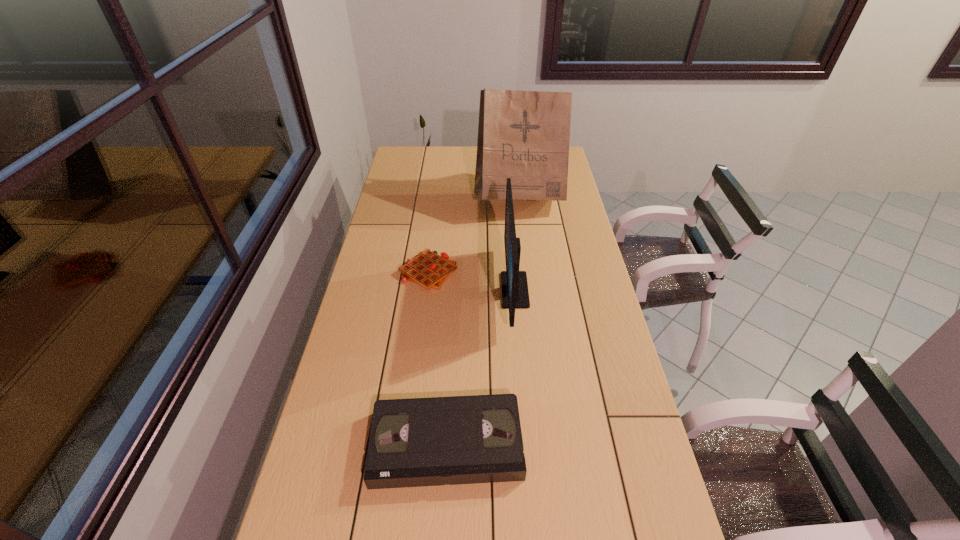
I want to click on free space that is in between the shortest object and the farthest object, so click(x=473, y=237).

This screenshot has height=540, width=960. What are the coordinates of `vacant space in between the nearest object and the computer monitor` in the screenshot? It's located at (481, 367).

Find the location of a particular element. vacant space that is in between the waffle and the grocery bag is located at coordinates (473, 237).

Image resolution: width=960 pixels, height=540 pixels. I want to click on vacant space that is in between the nearest object and the third shortest object, so click(x=481, y=367).

Image resolution: width=960 pixels, height=540 pixels. Identify the location of free space between the computer monitor and the waffle. (471, 281).

At what (x,y) coordinates should I click in order to perform the action: click on free space between the videotape and the shortest object. Please return your answer as a coordinate pair (x, y). The image size is (960, 540). Looking at the image, I should click on (438, 358).

Find the location of a particular element. free space between the nearest object and the waffle is located at coordinates (438, 358).

Where is `object that is the closest to the grocery bag`? object that is the closest to the grocery bag is located at coordinates (515, 294).

Image resolution: width=960 pixels, height=540 pixels. Identify the location of object that is the third closest to the shortest object. tap(415, 442).

You are a GUI agent. You are given a task and a screenshot of the screen. Output one action in this format:
    pyautogui.click(x=<x>, y=<y>)
    Task: Click on the blank area in the image that satisfies the following two spatial constraints: 1. on the front side of the nearest object; 2. on the left side of the shortest object
    The image size is (960, 540).
    Given the screenshot: What is the action you would take?
    click(x=407, y=444)